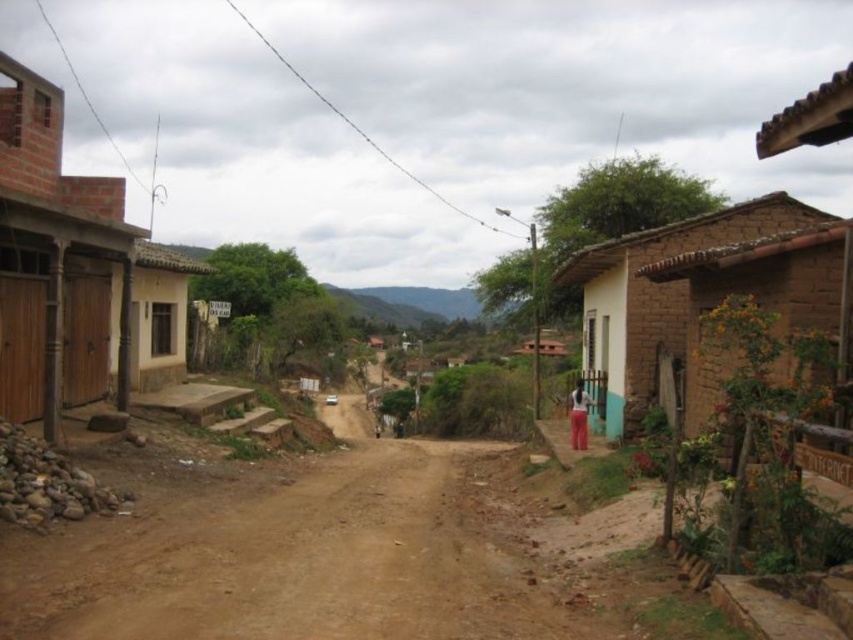
Question: Is brown brick hut at left further to camera compared to brown clay hut at right?

Choices:
 (A) no
 (B) yes

Answer: (A)

Question: Does brown brick hut at left have a greater width compared to brown clay hut at right?

Choices:
 (A) yes
 (B) no

Answer: (B)

Question: Which point is farther to the camera?

Choices:
 (A) (120, 180)
 (B) (660, 326)

Answer: (B)

Question: Among these objects, which one is nearest to the camera?

Choices:
 (A) brown brick hut at left
 (B) brown clay hut at right

Answer: (A)

Question: Is brown brick hut at left wider than brown clay hut at right?

Choices:
 (A) no
 (B) yes

Answer: (A)